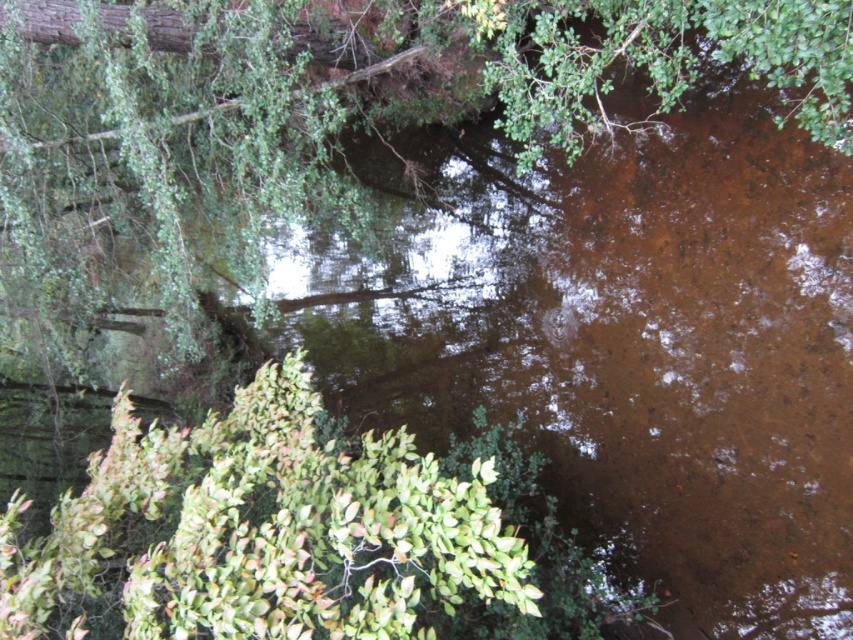
You are standing in the serene natural scene by the water. You see two points marked on the ground. Which point is closer to you, point (80, 68) or point (474, 593)?

Point (474, 593) is closer to you because it is less further to the camera than point (80, 68).

Consider the image. In the serene natural scene with the calm brownish water, you notice a green leafy tree at upper left and a green leafy bush at lower left. Which of these two plants has a greater width?

The green leafy tree at upper left has a greater width than the green leafy bush at lower left.

You are standing in the middle of the scene and want to walk towards the green leafy bush at lower left. Which direction should you walk to avoid the green leafy tree at upper left?

The green leafy bush at lower left is behind the green leafy tree at upper left, so you should walk to the right or left side around the tree to reach the bush without going through it.